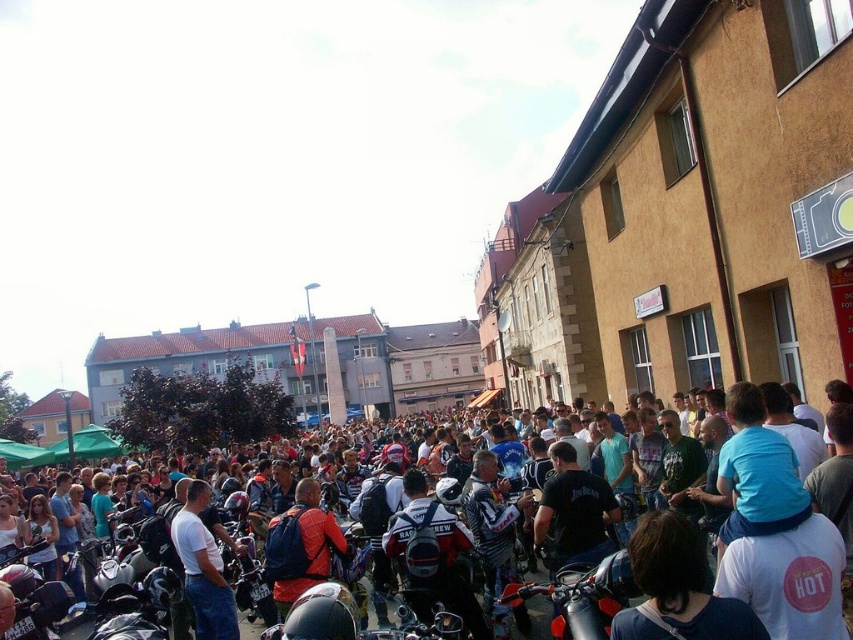
Question: From the image, what is the correct spatial relationship of red and white motorcycle at center in relation to orange fabric jacket at center?

Choices:
 (A) left
 (B) right

Answer: (B)

Question: Which point is farther from the camera taking this photo?

Choices:
 (A) (312, 557)
 (B) (456, 589)
 (C) (581, 488)
 (D) (202, 541)

Answer: (D)

Question: Is red and white motorcycle at center above black leather jacket at center?

Choices:
 (A) yes
 (B) no

Answer: (B)

Question: Which of the following is the closest to the observer?

Choices:
 (A) black leather jacket at center
 (B) red and white motorcycle at center

Answer: (A)

Question: Which point is farther from the camera taking this photo?

Choices:
 (A) (405, 484)
 (B) (306, 532)

Answer: (A)

Question: Is dark blue leather jackets at center below black leather jacket at center?

Choices:
 (A) no
 (B) yes

Answer: (B)